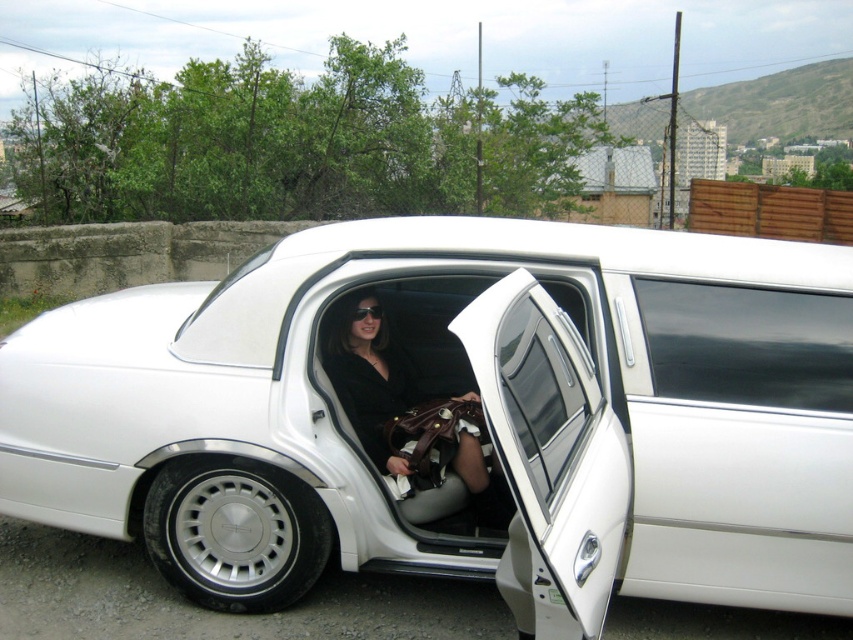
In the scene shown: You are a photographer standing at a certain distance from the white glossy limousine at center. You want to capture a full view of the limousine without any distortion. According to photography guidelines, the minimum recommended distance for such a shot is 2 meters. Can you take the photo from your current position?

The distance between you and the white glossy limousine at center is 2.25 meters, which exceeds the minimum recommended distance of 2 meters. Therefore, you can take the photo from your current position without distortion.

Consider the image. You are standing in front of the white glossy limousine at center and want to take a photo of it from a distance that allows you to capture the entire vehicle in the frame. Considering your camera has a standard lens with a 50mm focal length, which is suitable for capturing subjects at a distance of up to 10 feet, can you take the photo without moving closer? Explain your reasoning.

The white glossy limousine at center is 7.38 feet away from the viewer. Since the camera lens can capture up to 10 feet, the distance is within the acceptable range. Therefore, you can take the photo without moving closer.